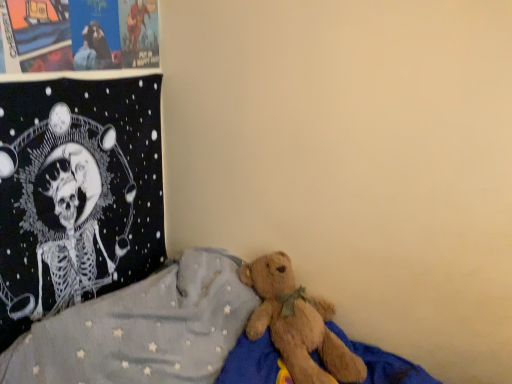
Describe the element at coordinates (78, 35) in the screenshot. I see `matte paper posters at upper left` at that location.

The width and height of the screenshot is (512, 384). I want to click on black fabric tapestry at upper left, so click(x=77, y=193).

Could you tell me if matte paper posters at upper left is turned towards black fabric tapestry at upper left?

No.

From the image's perspective, is matte paper posters at upper left positioned above or below black fabric tapestry at upper left?

matte paper posters at upper left is above black fabric tapestry at upper left.

Which object is wider, matte paper posters at upper left or black fabric tapestry at upper left?

Wider between the two is black fabric tapestry at upper left.

Based on the photo, is the surface of matte paper posters at upper left in direct contact with black fabric tapestry at upper left?

No, matte paper posters at upper left is not in contact with black fabric tapestry at upper left.

Considering their positions, is brown plush bear at lower right located in front of or behind black fabric tapestry at upper left?

Visually, brown plush bear at lower right is located in front of black fabric tapestry at upper left.

Is brown plush bear at lower right turned away from black fabric tapestry at upper left?

No.

How far apart are brown plush bear at lower right and black fabric tapestry at upper left?

brown plush bear at lower right and black fabric tapestry at upper left are 13.99 inches apart from each other.

From the image's perspective, is brown plush bear at lower right located above or below black fabric tapestry at upper left?

From the image's perspective, brown plush bear at lower right appears below black fabric tapestry at upper left.

Is brown plush bear at lower right wider than matte paper posters at upper left?

Indeed, brown plush bear at lower right has a greater width compared to matte paper posters at upper left.

Is brown plush bear at lower right surrounding matte paper posters at upper left?

No.

From the image's perspective, which is above, brown plush bear at lower right or matte paper posters at upper left?

matte paper posters at upper left.

Does matte paper posters at upper left have a greater width compared to brown plush bear at lower right?

No.

From the image's perspective, between matte paper posters at upper left and brown plush bear at lower right, who is located below?

brown plush bear at lower right appears lower in the image.

Which is correct: matte paper posters at upper left is inside brown plush bear at lower right, or outside of it?

matte paper posters at upper left lies outside brown plush bear at lower right.

From a real-world perspective, between matte paper posters at upper left and brown plush bear at lower right, who is vertically lower?

In real-world perspective, brown plush bear at lower right is lower.

Is black fabric tapestry at upper left not inside brown plush bear at lower right?

Yes.

Does point (137, 127) come behind point (63, 381)?

Yes, point (137, 127) is behind point (63, 381).

Which of these two, black fabric tapestry at upper left or brown plush bear at lower right, is wider?

With larger width is brown plush bear at lower right.

Looking at this image, could you tell me if black fabric tapestry at upper left is facing matte paper posters at upper left?

No, black fabric tapestry at upper left is not aimed at matte paper posters at upper left.

Can you confirm if black fabric tapestry at upper left is positioned to the right of matte paper posters at upper left?

In fact, black fabric tapestry at upper left is to the left of matte paper posters at upper left.

Can you confirm if black fabric tapestry at upper left is bigger than matte paper posters at upper left?

Yes.

In the scene shown: Is black fabric tapestry at upper left touching matte paper posters at upper left?

No.

Locate an element on the screen. The image size is (512, 384). poster page that is behind the black fabric tapestry at upper left is located at coordinates (78, 35).

You are a GUI agent. You are given a task and a screenshot of the screen. Output one action in this format:
    pyautogui.click(x=<x>, y=<y>)
    Task: Click on the pillow above the brown plush bear at lower right (from a real-world perspective)
    
    Given the screenshot: What is the action you would take?
    pyautogui.click(x=77, y=193)

Estimate the real-world distances between objects in this image. Which object is closer to brown plush bear at lower right, black fabric tapestry at upper left or matte paper posters at upper left?

black fabric tapestry at upper left is closer to brown plush bear at lower right.

From the picture: Estimate the real-world distances between objects in this image. Which object is further from black fabric tapestry at upper left, matte paper posters at upper left or brown plush bear at lower right?

Based on the image, brown plush bear at lower right appears to be further to black fabric tapestry at upper left.

Which object lies nearer to the anchor point matte paper posters at upper left, black fabric tapestry at upper left or brown plush bear at lower right?

black fabric tapestry at upper left is closer to matte paper posters at upper left.

Based on their spatial positions, is brown plush bear at lower right or matte paper posters at upper left closer to black fabric tapestry at upper left?

matte paper posters at upper left lies closer to black fabric tapestry at upper left than the other object.

Considering their positions, is matte paper posters at upper left positioned further to brown plush bear at lower right than black fabric tapestry at upper left?

matte paper posters at upper left.

Based on their spatial positions, is brown plush bear at lower right or black fabric tapestry at upper left closer to matte paper posters at upper left?

black fabric tapestry at upper left is positioned closer to the anchor matte paper posters at upper left.

At what (x,y) coordinates should I click in order to perform the action: click on pillow between matte paper posters at upper left and brown plush bear at lower right in the up-down direction. Please return your answer as a coordinate pair (x, y). The image size is (512, 384). Looking at the image, I should click on (77, 193).